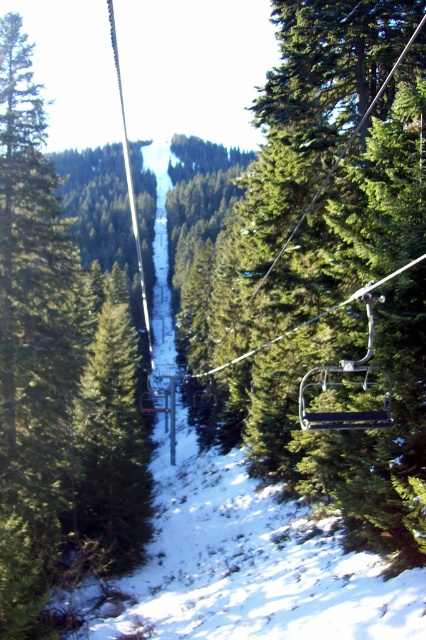
Question: Is green matte chair at center bigger than green matte tree at center?

Choices:
 (A) yes
 (B) no

Answer: (A)

Question: Which point is farther from the camera taking this photo?

Choices:
 (A) (310, 346)
 (B) (0, 230)

Answer: (B)

Question: Can you confirm if green matte chair at center is wider than green matte tree at center?

Choices:
 (A) yes
 (B) no

Answer: (A)

Question: Among these points, which one is farthest from the camera?

Choices:
 (A) (310, 444)
 (B) (75, 513)

Answer: (B)

Question: Is green matte chair at center smaller than green matte tree at center?

Choices:
 (A) no
 (B) yes

Answer: (A)